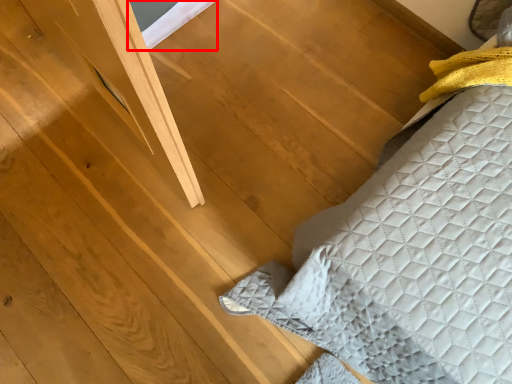
Question: In this image, where is window (annotated by the red box) located relative to furniture?

Choices:
 (A) left
 (B) right

Answer: (A)